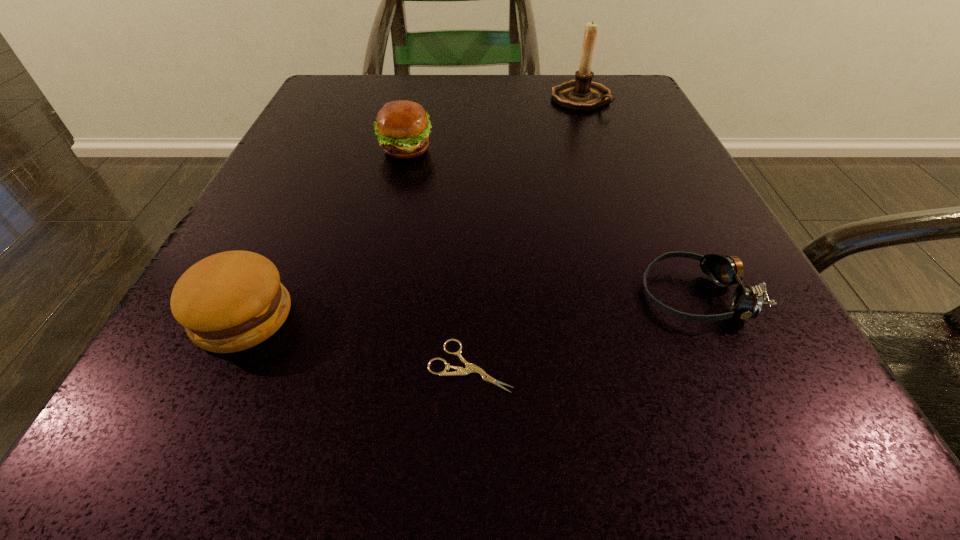
This screenshot has width=960, height=540. Find the location of `free space in the image that satisfies the following two spatial constraints: 1. on the back side of the nearer hamburger; 2. on the right side of the second object from left to right`. free space in the image that satisfies the following two spatial constraints: 1. on the back side of the nearer hamburger; 2. on the right side of the second object from left to right is located at coordinates (323, 150).

Locate an element on the screen. The width and height of the screenshot is (960, 540). free space that satisfies the following two spatial constraints: 1. on the back side of the left hamburger; 2. on the left side of the farther hamburger is located at coordinates (323, 150).

Find the location of a particular element. The width and height of the screenshot is (960, 540). vacant space that satisfies the following two spatial constraints: 1. on the back side of the candle holder; 2. on the right side of the farther hamburger is located at coordinates (417, 98).